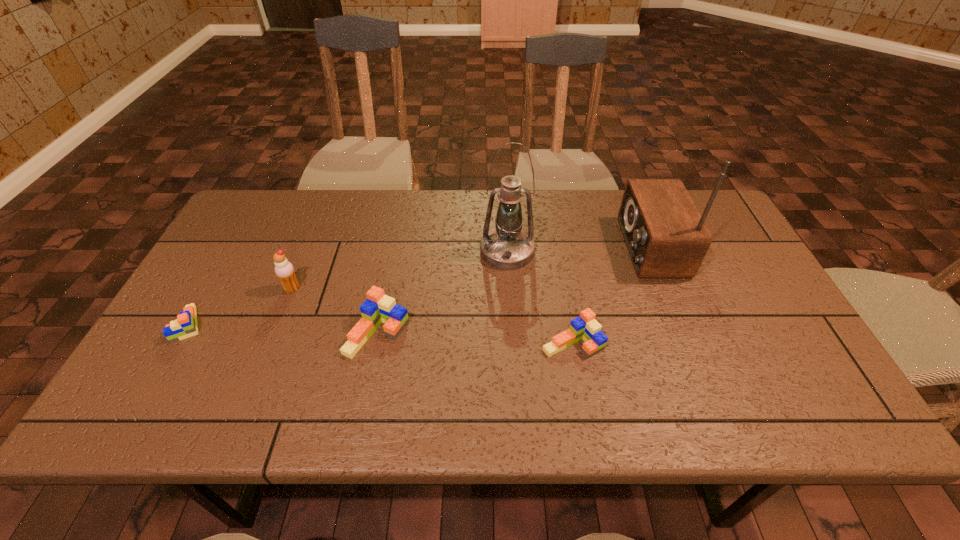
I want to click on the second closest Lego to the rightmost Lego, so click(185, 325).

Point out which Lego is positioned as the nearest to the rightmost Lego. Please provide its 2D coordinates. Your answer should be formatted as a tuple, i.e. [(x, y)], where the tuple contains the x and y coordinates of a point satisfying the conditions above.

[(378, 308)]

This screenshot has width=960, height=540. I want to click on blank area in the image that satisfies the following two spatial constraints: 1. on the back side of the oil lamp; 2. on the right side of the shortest object, so click(231, 251).

At what (x,y) coordinates should I click in order to perform the action: click on vacant space that satisfies the following two spatial constraints: 1. on the front side of the rightmost Lego; 2. on the right side of the leftmost object. Please return your answer as a coordinate pair (x, y). Looking at the image, I should click on (179, 343).